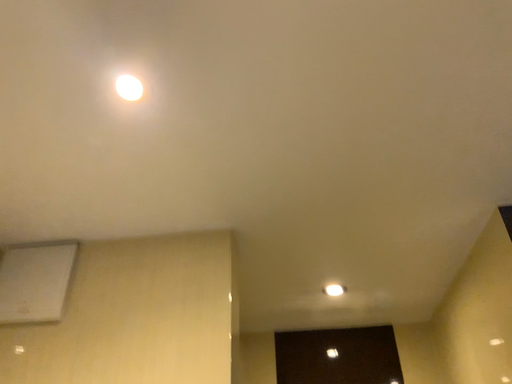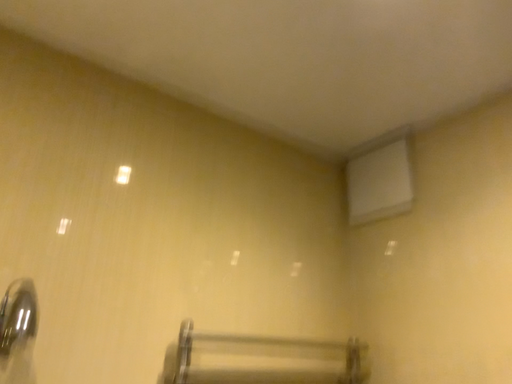
Question: Which way did the camera rotate in the video?

Choices:
 (A) rotated left
 (B) rotated right

Answer: (A)